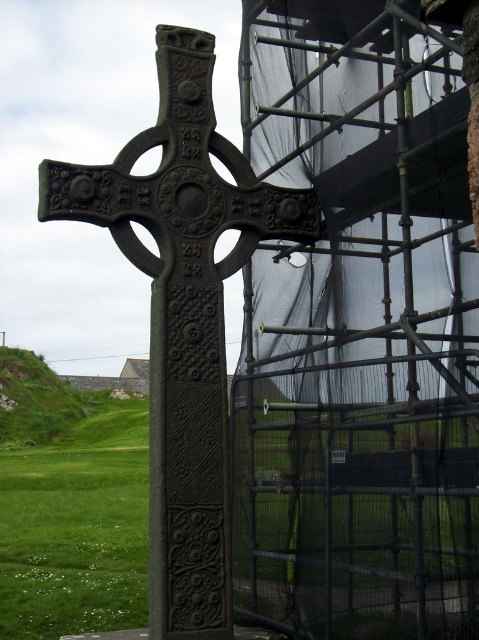
You are an architect inspecting a construction site. You notice the metal scaffolding at right and the dark gray cast iron cross at center. Based on their positions, which object is located to the east if the cross is facing north?

The metal scaffolding at right is to the right of the dark gray cast iron cross at center. Since the cross is facing north, its right side would be east. Therefore, the metal scaffolding at right is located to the east of the dark gray cast iron cross at center.

You are standing in front of the Celtic cross and notice a construction site in the background. There is a specific point marked at coordinates (358,330). What object is located at this point?

The object located at point (358,330) is the metal scaffolding at right.

You are an architect inspecting the construction site. You see the metal scaffolding at right and the dark gray cast iron cross at center. Which structure is taller?

The metal scaffolding at right is taller than the dark gray cast iron cross at center according to the description.